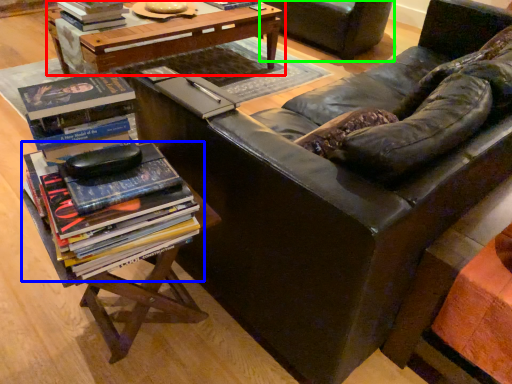
Question: Which object is the closest to the table (highlighted by a red box)? Choose among these: book (highlighted by a blue box) or chair (highlighted by a green box).

Choices:
 (A) book
 (B) chair

Answer: (B)